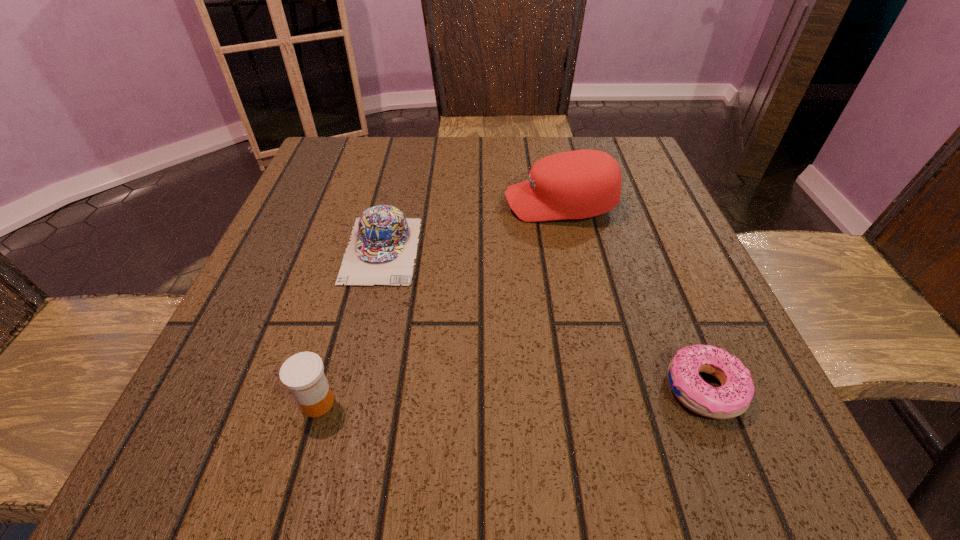
The width and height of the screenshot is (960, 540). What are the coordinates of `free space between the shortest object and the left cap` in the screenshot? It's located at (543, 319).

Where is `vacant region between the taller cap and the left cap`? The width and height of the screenshot is (960, 540). vacant region between the taller cap and the left cap is located at coordinates (471, 227).

The width and height of the screenshot is (960, 540). In order to click on free space between the shorter cap and the doughnut in this screenshot , I will do `click(543, 319)`.

The image size is (960, 540). What are the coordinates of `empty space between the second tallest object and the third tallest object` in the screenshot? It's located at (349, 326).

Locate an element on the screen. The image size is (960, 540). free space between the second tallest object and the doughnut is located at coordinates (511, 395).

Locate an element on the screen. The width and height of the screenshot is (960, 540). free space between the shortest object and the left cap is located at coordinates (543, 319).

The width and height of the screenshot is (960, 540). In order to click on empty space that is in between the shorter cap and the second tallest object in this screenshot , I will do `click(349, 326)`.

The image size is (960, 540). I want to click on empty space that is in between the medicine and the doughnut, so click(x=511, y=395).

Find the location of `vacant area between the medicine and the right cap`. vacant area between the medicine and the right cap is located at coordinates (439, 303).

Locate which object ranks third in proximity to the third shortest object. Please provide its 2D coordinates. Your answer should be formatted as a tuple, i.e. [(x, y)], where the tuple contains the x and y coordinates of a point satisfying the conditions above.

[(733, 398)]